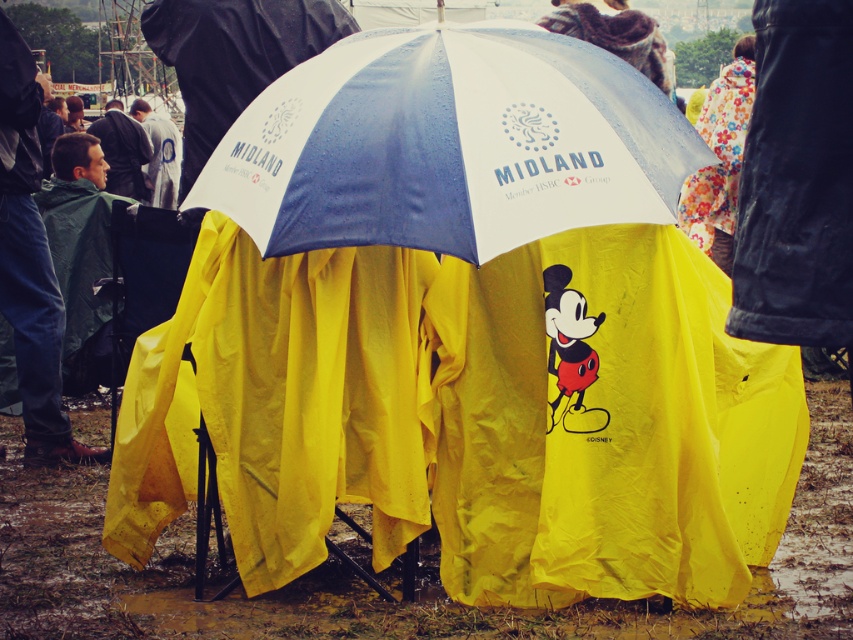
Question: Is whiteumbrella at center smaller than green waterproof jacket at lower left?

Choices:
 (A) yes
 (B) no

Answer: (B)

Question: Which of the following is the farthest from the observer?

Choices:
 (A) green waterproof jacket at lower left
 (B) whiteumbrella at center

Answer: (A)

Question: Does whiteumbrella at center have a larger size compared to green waterproof jacket at lower left?

Choices:
 (A) no
 (B) yes

Answer: (B)

Question: Can you confirm if whiteumbrella at center is positioned above green waterproof jacket at lower left?

Choices:
 (A) no
 (B) yes

Answer: (B)

Question: Which point appears closest to the camera in this image?

Choices:
 (A) (428, 116)
 (B) (15, 252)

Answer: (A)

Question: Which object appears farthest from the camera in this image?

Choices:
 (A) whiteumbrella at center
 (B) green waterproof jacket at lower left

Answer: (B)